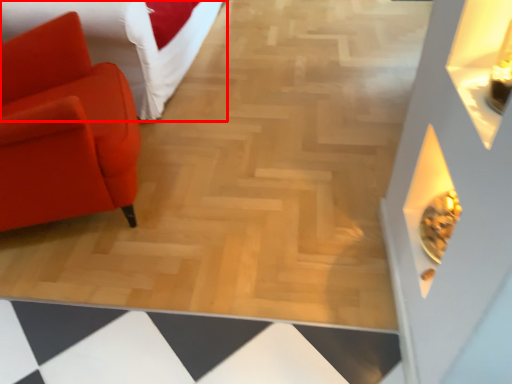
Question: From the image, what is the correct spatial relationship of furniture (annotated by the red box) in relation to chair?

Choices:
 (A) right
 (B) left

Answer: (B)